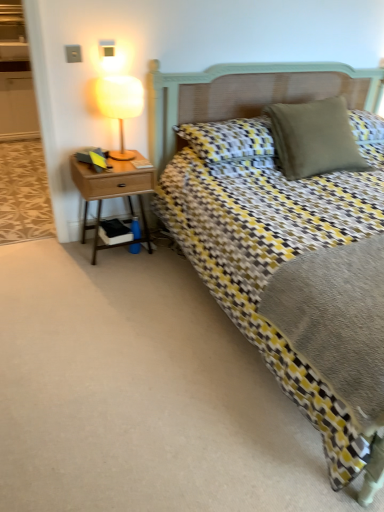
Locate an element on the screen. The image size is (384, 512). matte beige pillow at upper right, acting as the 1th pillow starting from the right is located at coordinates (314, 137).

How much space does textured beige pillow at center, the 2th pillow when ordered from right to left, occupy horizontally?

It is 45.02 centimeters.

Identify the location of yellow checkered fabric bed at center. The image size is (384, 512). (242, 93).

In the scene shown: Can you confirm if matte beige pillow at upper right, placed as the second pillow when sorted from left to right, is positioned to the right of woodennightstand at left?

Yes.

Which point is more forward, (295, 139) or (96, 215)?

The point (295, 139) is more forward.

Which object is more forward, matte beige pillow at upper right, acting as the 1th pillow starting from the right, or woodennightstand at left?

matte beige pillow at upper right, acting as the 1th pillow starting from the right.

Looking at their sizes, would you say matte beige pillow at upper right, placed as the second pillow when sorted from left to right, is wider or thinner than woodennightstand at left?

matte beige pillow at upper right, placed as the second pillow when sorted from left to right, is wider than woodennightstand at left.

Which of these two, woodennightstand at left or matte beige pillow at upper right, acting as the 1th pillow starting from the right, stands taller?

woodennightstand at left.

Is woodennightstand at left turned away from matte beige pillow at upper right, acting as the 1th pillow starting from the right?

woodennightstand at left is not turned away from matte beige pillow at upper right, acting as the 1th pillow starting from the right.

How different are the orientations of woodennightstand at left and matte beige pillow at upper right, placed as the second pillow when sorted from left to right, in degrees?

The angle between the facing direction of woodennightstand at left and the facing direction of matte beige pillow at upper right, placed as the second pillow when sorted from left to right, is 0.467 degrees.

From the picture: Would you consider woodennightstand at left to be distant from matte beige pillow at upper right, placed as the second pillow when sorted from left to right?

Yes, woodennightstand at left and matte beige pillow at upper right, placed as the second pillow when sorted from left to right, are located far from each other.

Between yellow checkered fabric bed at center and textured beige pillow at center, the 2th pillow when ordered from right to left, which one has smaller size?

textured beige pillow at center, the 2th pillow when ordered from right to left, is smaller.

Measure the distance from yellow checkered fabric bed at center to textured beige pillow at center, which is the first pillow in left-to-right order.

A distance of 13.23 inches exists between yellow checkered fabric bed at center and textured beige pillow at center, which is the first pillow in left-to-right order.

Would you say textured beige pillow at center, which is the first pillow in left-to-right order, is part of yellow checkered fabric bed at center's contents?

Yes, textured beige pillow at center, which is the first pillow in left-to-right order, is surrounded by yellow checkered fabric bed at center.

From their relative heights in the image, would you say yellow checkered fabric bed at center is taller or shorter than textured beige pillow at center, the 2th pillow when ordered from right to left?

Clearly, yellow checkered fabric bed at center is taller compared to textured beige pillow at center, the 2th pillow when ordered from right to left.

From a real-world perspective, is yellow checkered fabric bed at center positioned over matte beige pillow at upper right, acting as the 1th pillow starting from the right, based on gravity?

Incorrect, from a real-world perspective, yellow checkered fabric bed at center is lower than matte beige pillow at upper right, acting as the 1th pillow starting from the right.

From the image's perspective, would you say yellow checkered fabric bed at center is positioned over matte beige pillow at upper right, placed as the second pillow when sorted from left to right?

No, from the image's perspective, yellow checkered fabric bed at center is not above matte beige pillow at upper right, placed as the second pillow when sorted from left to right.

Is yellow checkered fabric bed at center positioned in front of matte beige pillow at upper right, placed as the second pillow when sorted from left to right?

Yes, yellow checkered fabric bed at center is in front of matte beige pillow at upper right, placed as the second pillow when sorted from left to right.

Visually, is yellow checkered fabric bed at center positioned to the left or to the right of matte beige pillow at upper right, placed as the second pillow when sorted from left to right?

From the image, it's evident that yellow checkered fabric bed at center is to the right of matte beige pillow at upper right, placed as the second pillow when sorted from left to right.

Identify the location of bed on the right of woodennightstand at left. (242, 93).

In the scene shown: Is yellow checkered fabric bed at center oriented towards woodennightstand at left?

No, yellow checkered fabric bed at center is not aimed at woodennightstand at left.

Would you say yellow checkered fabric bed at center is inside or outside woodennightstand at left?

yellow checkered fabric bed at center is not enclosed by woodennightstand at left.

From the image's perspective, is yellow checkered fabric bed at center above or below woodennightstand at left?

Based on their image positions, yellow checkered fabric bed at center is located above woodennightstand at left.

Relative to matte yellow lampshade at upper left, is woodennightstand at left in front or behind?

Visually, woodennightstand at left is located behind matte yellow lampshade at upper left.

Which of these two, woodennightstand at left or matte yellow lampshade at upper left, is wider?

A: woodennightstand at left.

Is woodennightstand at left directly adjacent to matte yellow lampshade at upper left?

They are not placed beside each other.

From the image's perspective, is woodennightstand at left located above or below matte yellow lampshade at upper left?

Clearly, from the image's perspective, woodennightstand at left is below matte yellow lampshade at upper left.

Is yellow checkered fabric bed at center wider than matte yellow lampshade at upper left?

Yes.

At what (x,y) coordinates should I click in order to perform the action: click on bedside lamp located behind the yellow checkered fabric bed at center. Please return your answer as a coordinate pair (x, y). Image resolution: width=384 pixels, height=512 pixels. Looking at the image, I should click on (120, 104).

Between point (377, 90) and point (132, 91), which one is positioned in front?

The point (132, 91) is closer.

From the image's perspective, which one is positioned higher, yellow checkered fabric bed at center or matte yellow lampshade at upper left?

matte yellow lampshade at upper left, from the image's perspective.

The width and height of the screenshot is (384, 512). Identify the location of the 2nd pillow above the woodennightstand at left (from the image's perspective). (314, 137).

In the image, there is a matte beige pillow at upper right, acting as the 1th pillow starting from the right. Where is `nightstand below it (from the image's perspective)`? The image size is (384, 512). nightstand below it (from the image's perspective) is located at coordinates (111, 191).

Looking at the image, which one is located further to yellow checkered fabric bed at center, woodennightstand at left or matte beige pillow at upper right, acting as the 1th pillow starting from the right?

woodennightstand at left is positioned further to the anchor yellow checkered fabric bed at center.

Which object lies further to the anchor point matte beige pillow at upper right, placed as the second pillow when sorted from left to right, yellow checkered fabric bed at center or textured beige pillow at center, the 2th pillow when ordered from right to left?

The object further to matte beige pillow at upper right, placed as the second pillow when sorted from left to right, is yellow checkered fabric bed at center.

When comparing their distances from matte yellow lampshade at upper left, does yellow checkered fabric bed at center or textured beige pillow at center, the 2th pillow when ordered from right to left, seem closer?

Among the two, yellow checkered fabric bed at center is located nearer to matte yellow lampshade at upper left.

Looking at the image, which one is located further to yellow checkered fabric bed at center, matte beige pillow at upper right, placed as the second pillow when sorted from left to right, or matte yellow lampshade at upper left?

Based on the image, matte beige pillow at upper right, placed as the second pillow when sorted from left to right, appears to be further to yellow checkered fabric bed at center.

Considering their positions, is textured beige pillow at center, which is the first pillow in left-to-right order, positioned closer to yellow checkered fabric bed at center than woodennightstand at left?

textured beige pillow at center, which is the first pillow in left-to-right order, lies closer to yellow checkered fabric bed at center than the other object.

Which object lies nearer to the anchor point textured beige pillow at center, which is the first pillow in left-to-right order, matte yellow lampshade at upper left or yellow checkered fabric bed at center?

yellow checkered fabric bed at center.

Based on their spatial positions, is woodennightstand at left or textured beige pillow at center, which is the first pillow in left-to-right order, closer to matte yellow lampshade at upper left?

woodennightstand at left lies closer to matte yellow lampshade at upper left than the other object.

Based on their spatial positions, is yellow checkered fabric bed at center or woodennightstand at left further from matte yellow lampshade at upper left?

yellow checkered fabric bed at center lies further to matte yellow lampshade at upper left than the other object.

Find the location of a particular element. bedside lamp between woodennightstand at left and textured beige pillow at center, which is the first pillow in left-to-right order, from left to right is located at coordinates (120, 104).

The image size is (384, 512). Identify the location of bedside lamp located between woodennightstand at left and yellow checkered fabric bed at center in the left-right direction. (120, 104).

The image size is (384, 512). Identify the location of pillow between yellow checkered fabric bed at center and woodennightstand at left from front to back. (314, 137).

The image size is (384, 512). I want to click on pillow between yellow checkered fabric bed at center and textured beige pillow at center, which is the first pillow in left-to-right order, in the front-back direction, so click(x=314, y=137).